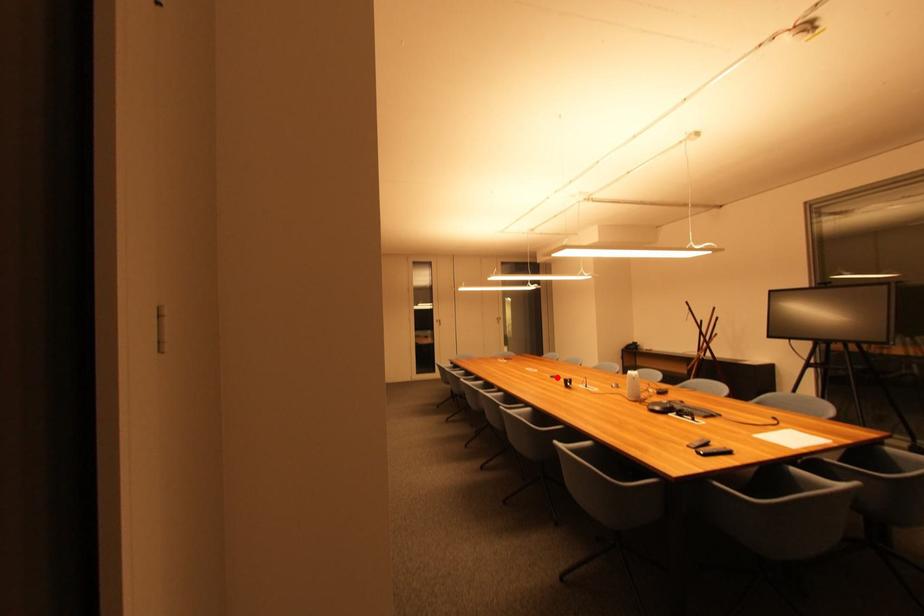
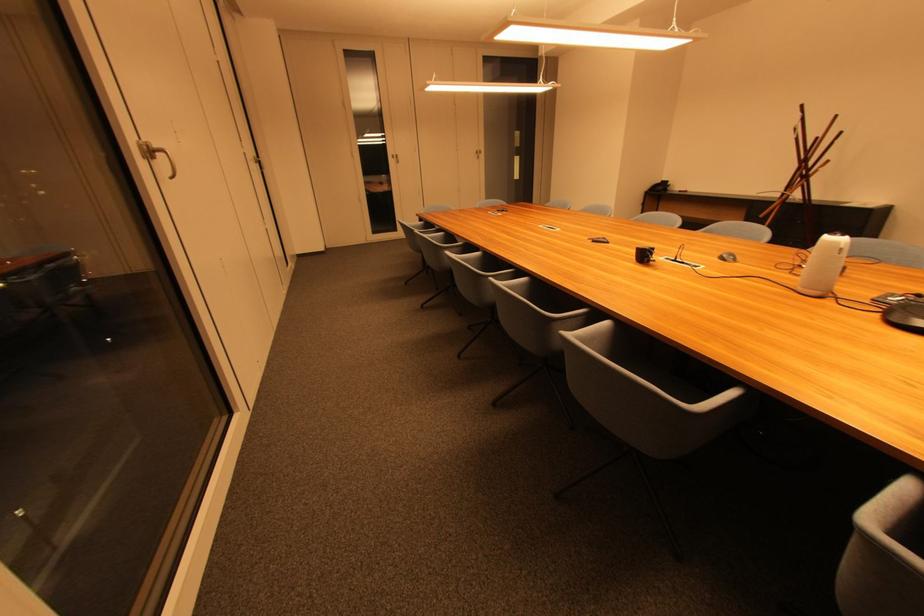
Where in the second image is the point corresponding to the highlighted location from the first image?

(596, 240)